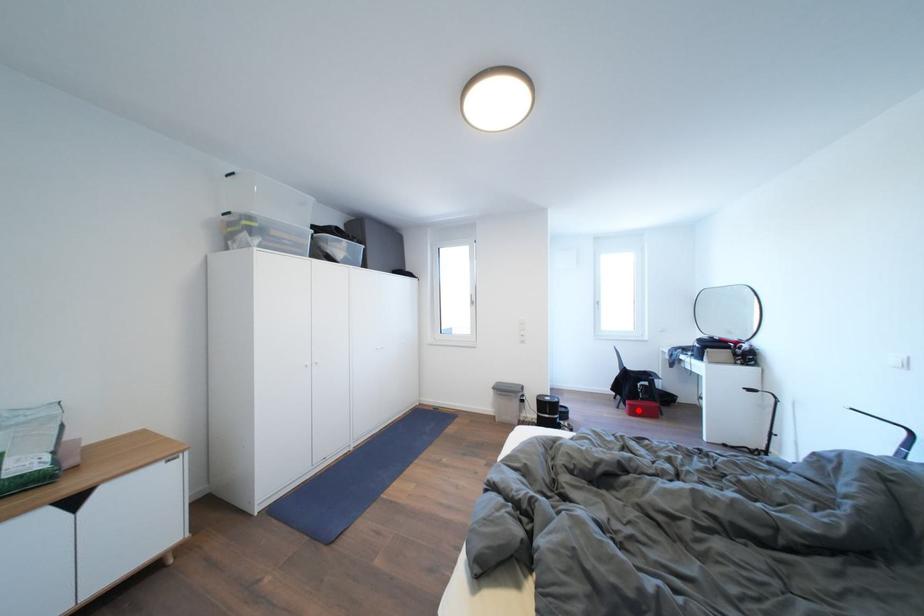
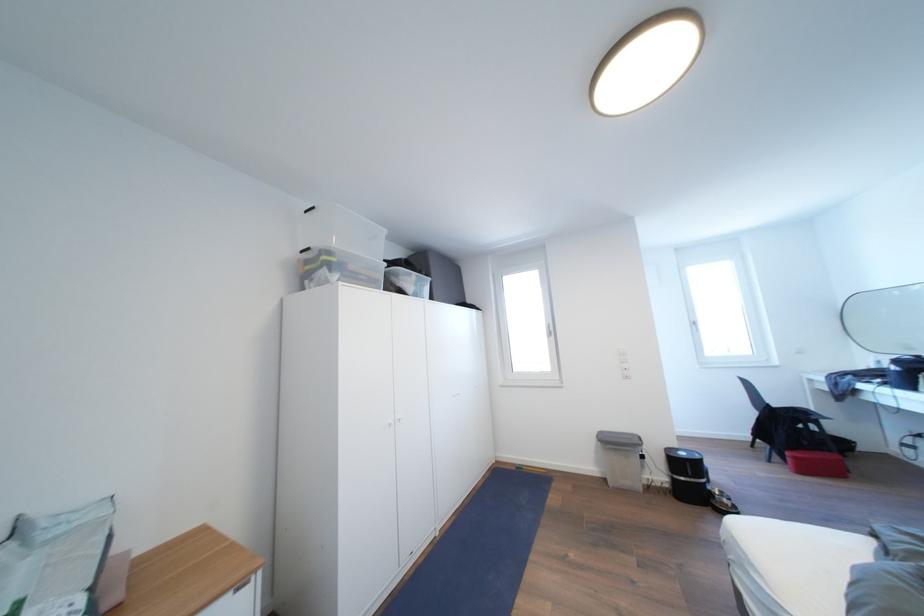
Question: I am providing you with two images of the same scene from different viewpoints. A red point is marked on the first image. Is the red point's position out of view in image 2?

Choices:
 (A) Yes
 (B) No

Answer: (B)